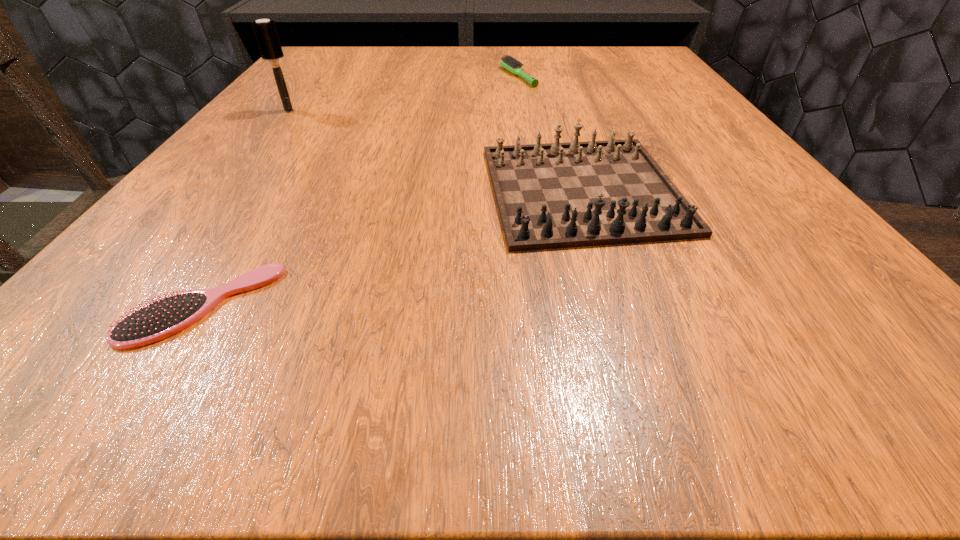
This screenshot has height=540, width=960. In order to click on the second farthest hairbrush in this screenshot , I will do `click(265, 31)`.

Locate an element on the screen. the second farthest object is located at coordinates (265, 31).

Locate an element on the screen. This screenshot has height=540, width=960. the third farthest object is located at coordinates (558, 195).

This screenshot has width=960, height=540. What are the coordinates of `the third shortest object` in the screenshot? It's located at (558, 195).

The image size is (960, 540). I want to click on the farthest object, so click(509, 63).

This screenshot has width=960, height=540. In order to click on the rightmost hairbrush in this screenshot , I will do `click(509, 63)`.

In order to click on the shortest object in this screenshot , I will do `click(160, 319)`.

Identify the location of the nearest hairbrush. (160, 319).

At what (x,y) coordinates should I click in order to perform the action: click on vacant area situated 0.250m on the back of the third nearest object. Please return your answer as a coordinate pair (x, y). Looking at the image, I should click on (325, 64).

This screenshot has width=960, height=540. I want to click on vacant area located 0.130m on the right of the second tallest object, so pos(772,190).